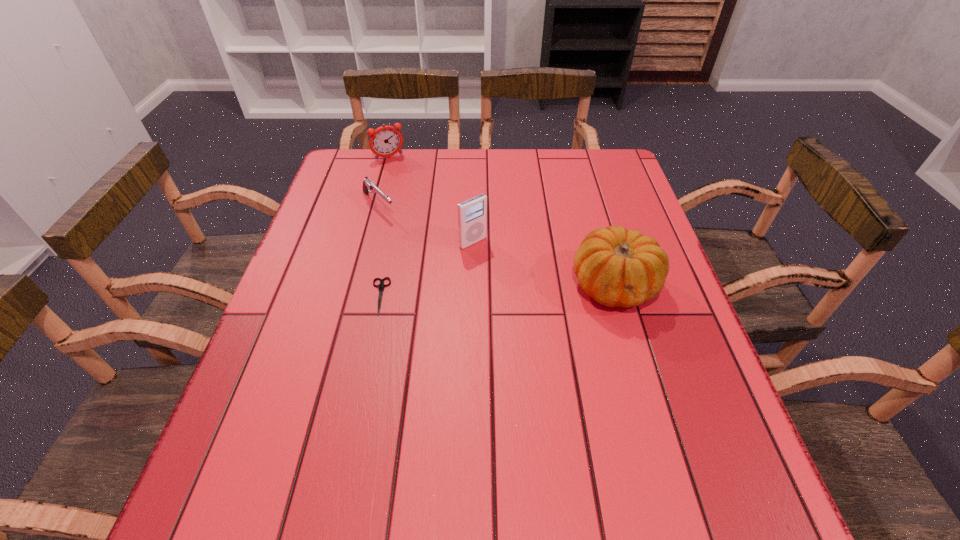
Locate an element on the screen. vacant space located on the front-facing side of the second farthest object is located at coordinates (433, 261).

Find the location of a particular element. The image size is (960, 540). free space located on the front-facing side of the second farthest object is located at coordinates (428, 256).

The width and height of the screenshot is (960, 540). I want to click on vacant space located 0.240m on the front-facing side of the third farthest object, so click(x=545, y=307).

The height and width of the screenshot is (540, 960). What are the coordinates of `blank space located 0.150m on the front-facing side of the third farthest object` in the screenshot? It's located at (519, 283).

This screenshot has height=540, width=960. Find the location of `vacant space located on the front-facing side of the third farthest object`. vacant space located on the front-facing side of the third farthest object is located at coordinates (537, 299).

The image size is (960, 540). Find the location of `free spot located 0.130m on the front-facing side of the alarm clock`. free spot located 0.130m on the front-facing side of the alarm clock is located at coordinates (408, 183).

The height and width of the screenshot is (540, 960). Find the location of `vacant space located 0.290m on the front-facing side of the alarm clock`. vacant space located 0.290m on the front-facing side of the alarm clock is located at coordinates (426, 213).

Find the location of a particular element. vacant space situated on the front-facing side of the alarm clock is located at coordinates coord(426,213).

The width and height of the screenshot is (960, 540). Find the location of `pistol located at the far edge`. pistol located at the far edge is located at coordinates (368, 186).

At what (x,y) coordinates should I click in order to perform the action: click on alarm clock that is at the far edge. Please return your answer as a coordinate pair (x, y). Image resolution: width=960 pixels, height=540 pixels. Looking at the image, I should click on (385, 141).